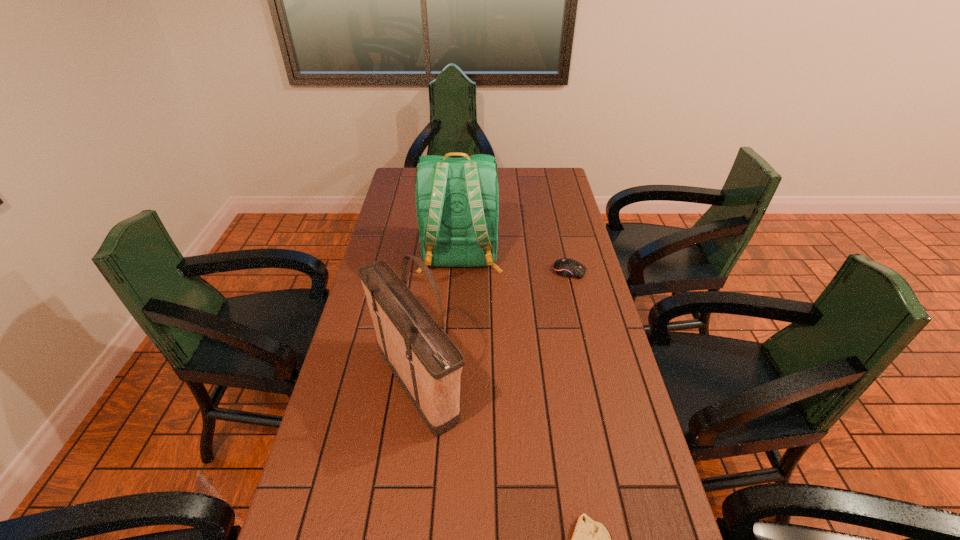
I want to click on backpack, so [457, 199].

Identify the location of the third farthest object. (426, 362).

Locate an element on the screen. This screenshot has width=960, height=540. computer mouse is located at coordinates (566, 267).

This screenshot has width=960, height=540. In order to click on vacant space located 0.230m on the back of the backpack in this screenshot , I will do `click(456, 339)`.

The image size is (960, 540). What are the coordinates of `free region located on the back of the second nearest object` in the screenshot? It's located at (429, 290).

Image resolution: width=960 pixels, height=540 pixels. Identify the location of vacant space situated on the back of the computer mouse. (563, 242).

Where is `object present at the left edge`? Image resolution: width=960 pixels, height=540 pixels. object present at the left edge is located at coordinates (426, 362).

Image resolution: width=960 pixels, height=540 pixels. I want to click on object present at the right edge, so click(566, 267).

Locate an element on the screen. This screenshot has width=960, height=540. free space at the left edge of the desktop is located at coordinates (316, 476).

Find the location of `free region at the right edge of the desktop`. free region at the right edge of the desktop is located at coordinates (578, 227).